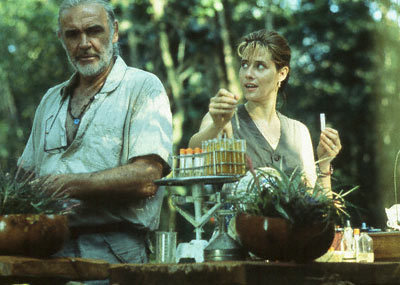
Image resolution: width=400 pixels, height=285 pixels. I want to click on pot, so click(308, 243).